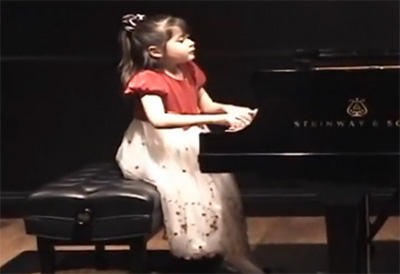
Locate an element on the screen. This screenshot has height=274, width=400. piano is located at coordinates (301, 94).